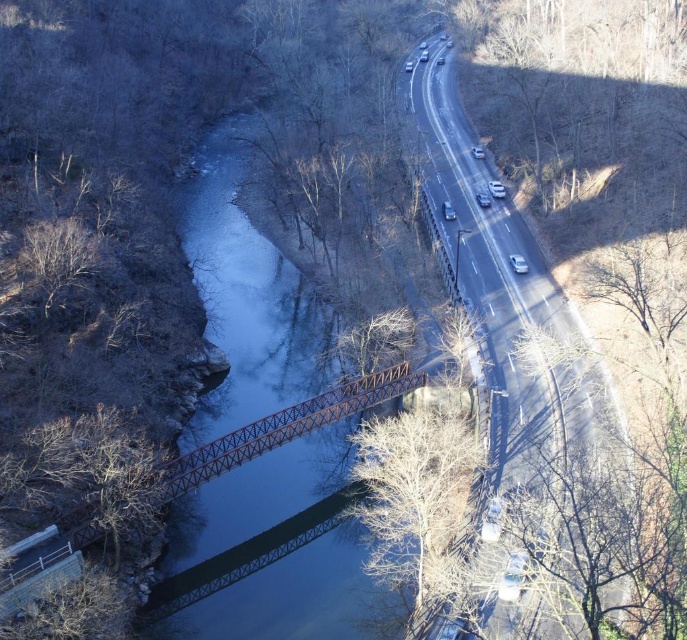
You are a drone operator flying over the landscape. You need to capture a photo where the metallic blue river at center is clearly visible in the foreground. Can you position the rusty metal bridge at center so that it appears behind the river in the photo?

Yes, the metallic blue river at center is further to the viewer than the rusty metal bridge at center, so positioning the drone to focus on the river will naturally place the bridge behind it in the background.

You are a drone operator tasked with capturing footage of the metallic blue river at center and the rusty metal bridge at center. Your drone has a maximum flight range of 25 meters. Can you fly your drone from one object to the other without exceeding its range?

The metallic blue river at center and the rusty metal bridge at center are 23.84 meters apart. Since the drone has a maximum flight range of 25 meters, it can safely fly between the two objects without exceeding its limit.

You are a drone operator trying to navigate a drone from point A to point B in the scene. The coordinates for point A are point [234,262] and point B are point [181,480]. Considering the bridge and river in the image, which point is closer to the bridge?

Point [181,480] is closer to the bridge because point [234,262] is behind it according to the description.